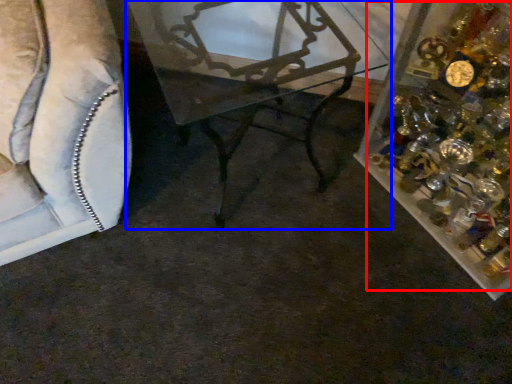
Question: Which object appears farthest to the camera in this image, christmas decoration (highlighted by a red box) or table (highlighted by a blue box)?

Choices:
 (A) christmas decoration
 (B) table

Answer: (B)